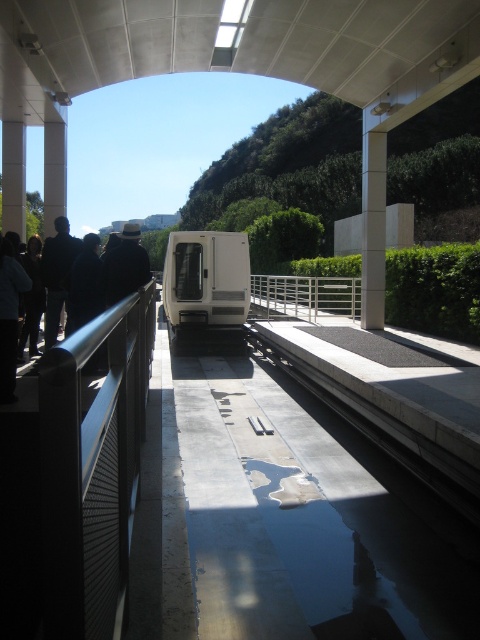
Question: Which of these objects is positioned closest to the stainless steel railing at center?

Choices:
 (A) concrete at center
 (B) metal mesh railing at left
 (C) white matte van at center
 (D) dark gray jacket at left

Answer: (C)

Question: Does white matte van at center have a larger size compared to concrete at center?

Choices:
 (A) yes
 (B) no

Answer: (A)

Question: Among these points, which one is nearest to the camera?

Choices:
 (A) (115, 387)
 (B) (456, 480)
 (C) (288, 308)
 (D) (8, 353)

Answer: (A)

Question: Is the position of dark blue jacket at left less distant than that of dark gray jacket at left?

Choices:
 (A) yes
 (B) no

Answer: (B)

Question: Is white matte van at center further to camera compared to dark blue jacket at left?

Choices:
 (A) no
 (B) yes

Answer: (B)

Question: Estimate the real-world distances between objects in this image. Which object is closer to the dark blue jacket at left?

Choices:
 (A) stainless steel railing at center
 (B) concrete at center
 (C) metal mesh railing at left
 (D) white matte van at center

Answer: (C)